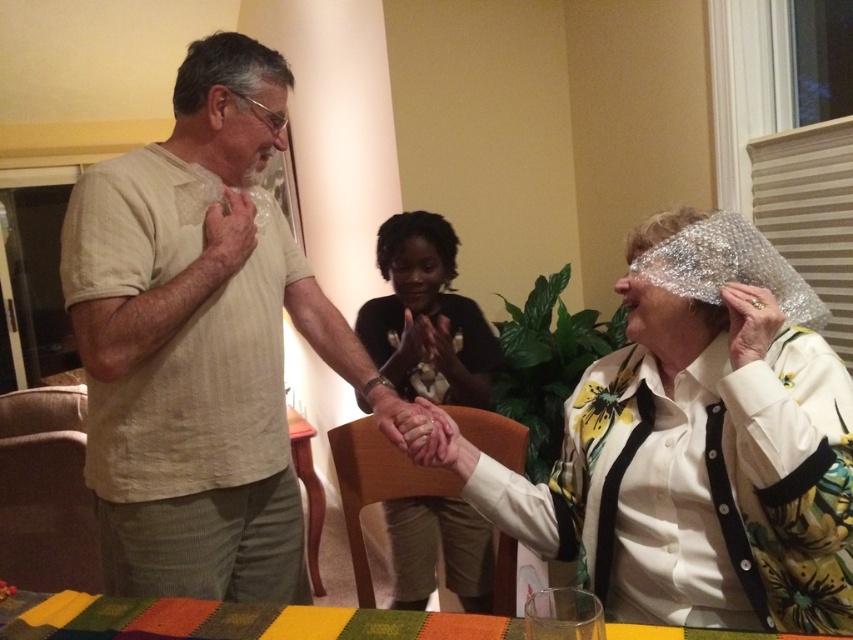
You are a photographer setting up for a group photo. You notice the matte black shirt at center and the multicolored woven cloth at lower center. Which item appears narrower when viewed from your position?

The matte black shirt at center appears narrower than the multicolored woven cloth at lower center because it has a lesser width compared to it.

You are a photographer setting up a shoot in this scene. You need to position a light source to the left of the shiny metallic foil at center and to the right of the matte black shirt at center. Is this possible based on their current positions?

Yes, the shiny metallic foil at center is to the right of the matte black shirt at center, so placing a light source to the left of the shiny metallic foil at center and to the right of the matte black shirt at center is possible.

You are a photographer setting up for a group photo. You notice the shiny metallic foil at center and the matte black shirt at center. Which object should you adjust to ensure both are fully visible in the frame?

The shiny metallic foil at center is taller than the matte black shirt at center. To ensure both are fully visible, you should lower the shiny metallic foil at center or raise the matte black shirt at center so their heights align within the frame.